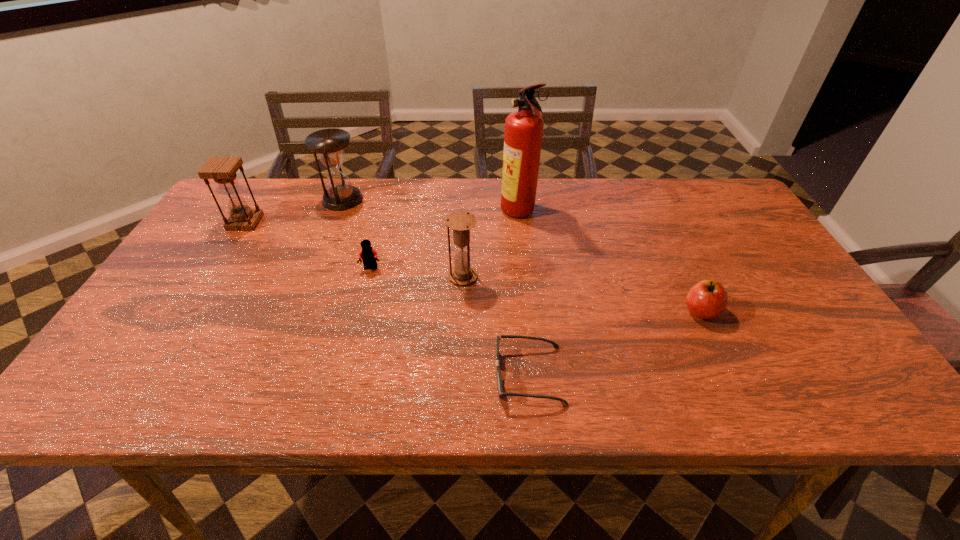
Image resolution: width=960 pixels, height=540 pixels. Find the location of `the shortest object`. the shortest object is located at coordinates (499, 381).

Identify the location of the nearest object. The image size is (960, 540). [499, 381].

The image size is (960, 540). Find the location of `vacant space situated 0.300m on the front-facing side of the tallest object`. vacant space situated 0.300m on the front-facing side of the tallest object is located at coordinates (399, 213).

The image size is (960, 540). I want to click on vacant region located on the front-facing side of the tallest object, so click(430, 213).

Locate an element on the screen. vacant space situated on the front-facing side of the tallest object is located at coordinates (379, 213).

At what (x,y) coordinates should I click in order to perform the action: click on vacant area situated on the right of the second hourglass from left to right. Please return your answer as a coordinate pair (x, y). Image resolution: width=960 pixels, height=540 pixels. Looking at the image, I should click on (434, 199).

In order to click on vacant space situated on the back of the second nearest hourglass in this screenshot , I will do `click(274, 178)`.

Identify the location of vacant region located on the front of the fourth object from left to right. The image size is (960, 540). (462, 302).

Find the location of a particular element. The width and height of the screenshot is (960, 540). vacant space situated on the front-facing side of the fifth object from right to left is located at coordinates (364, 295).

At what (x,y) coordinates should I click in order to perform the action: click on vacant space situated 0.260m on the back of the second nearest object. Please return your answer as a coordinate pair (x, y). Looking at the image, I should click on (662, 231).